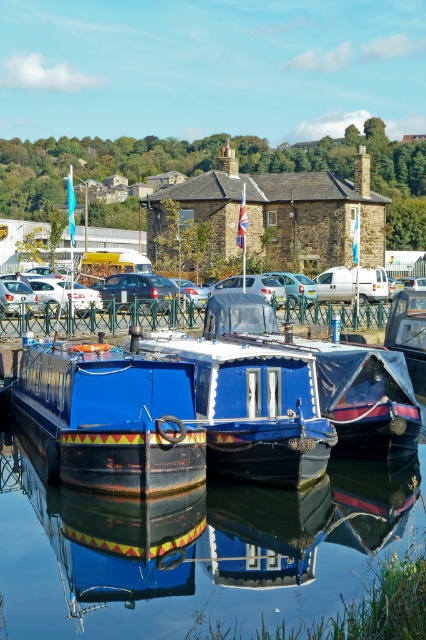
Is smooth dark blue water at center bigger than shiny blue boat at center?

Incorrect, smooth dark blue water at center is not larger than shiny blue boat at center.

Can you confirm if smooth dark blue water at center is thinner than shiny blue boat at center?

Correct, smooth dark blue water at center's width is less than shiny blue boat at center's.

Who is more forward, (74,616) or (37,365)?

Point (74,616) is more forward.

Find the location of a particular element. smooth dark blue water at center is located at coordinates (192, 550).